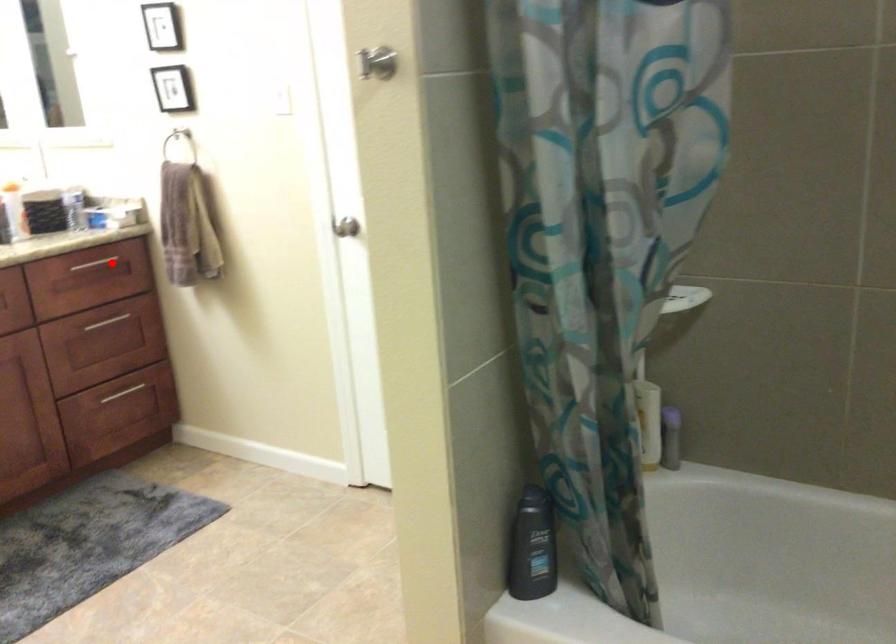
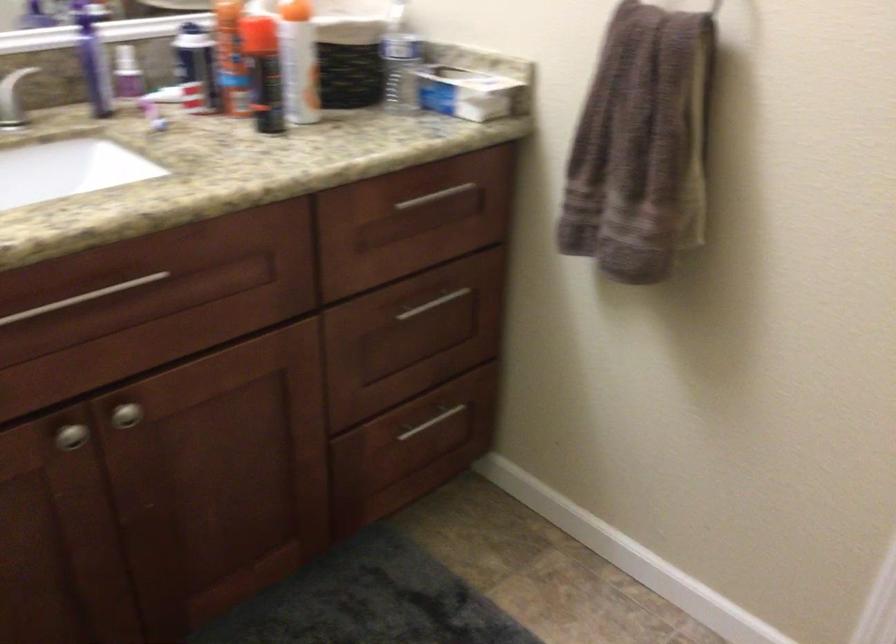
The point at the highlighted location is marked in the first image. Where is the corresponding point in the second image?

(445, 201)